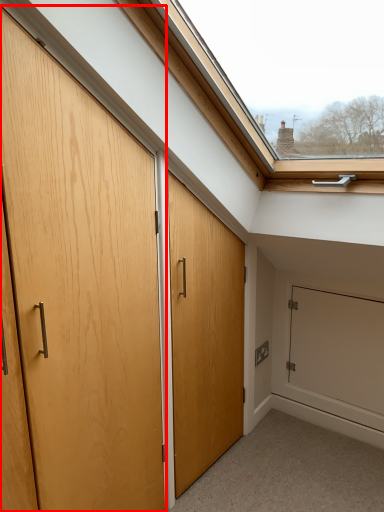
Question: From the image's perspective, what is the correct spatial relationship of door (annotated by the red box) in relation to screen door?

Choices:
 (A) above
 (B) below

Answer: (A)